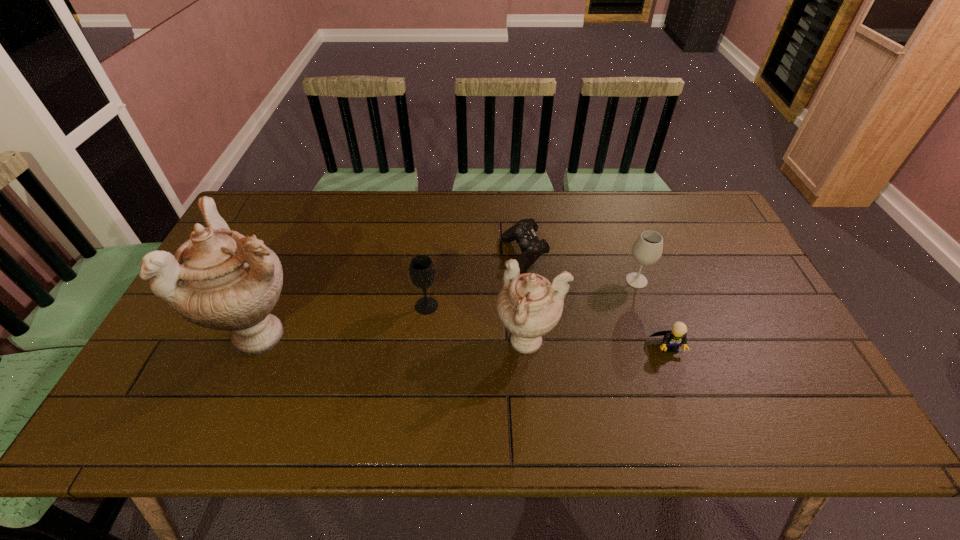
Find the location of a particular element. The height and width of the screenshot is (540, 960). the left urn is located at coordinates (219, 279).

You are a GUI agent. You are given a task and a screenshot of the screen. Output one action in this format:
    pyautogui.click(x=<x>, y=<y>)
    Task: Click on the taller urn
    Image resolution: width=960 pixels, height=540 pixels.
    Given the screenshot: What is the action you would take?
    pyautogui.click(x=219, y=279)

Identify the location of the shorter urn. This screenshot has width=960, height=540. (529, 306).

This screenshot has height=540, width=960. In order to click on the fifth shortest object in this screenshot , I will do `click(529, 306)`.

You are a GUI agent. You are given a task and a screenshot of the screen. Output one action in this format:
    pyautogui.click(x=<x>, y=<y>)
    Task: Click on the shortest object
    This screenshot has height=540, width=960.
    Given the screenshot: What is the action you would take?
    pyautogui.click(x=524, y=231)

You are a GUI agent. You are given a task and a screenshot of the screen. Output one action in this format:
    pyautogui.click(x=<x>, y=<y>)
    Task: Click on the second object from left to right
    
    Given the screenshot: What is the action you would take?
    pyautogui.click(x=421, y=269)

In order to click on the nearer wineglass in this screenshot , I will do `click(421, 269)`.

At what (x,y) coordinates should I click in order to perform the action: click on the farther wineglass. Please return your answer as a coordinate pair (x, y). This screenshot has height=540, width=960. Looking at the image, I should click on (648, 247).

Where is `the fifth tallest object`? The height and width of the screenshot is (540, 960). the fifth tallest object is located at coordinates (673, 339).

The image size is (960, 540). I want to click on free space located on the right of the leftmost object, so click(369, 333).